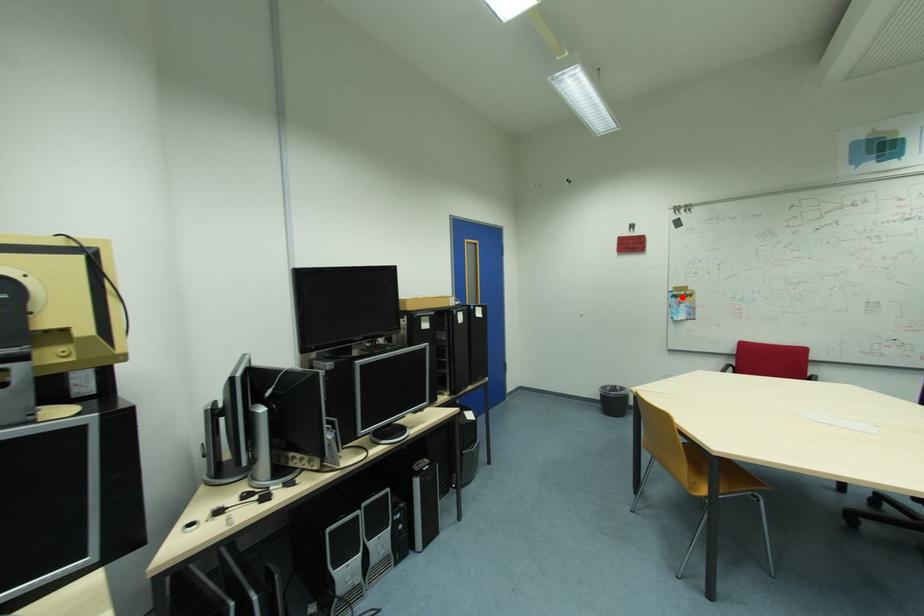
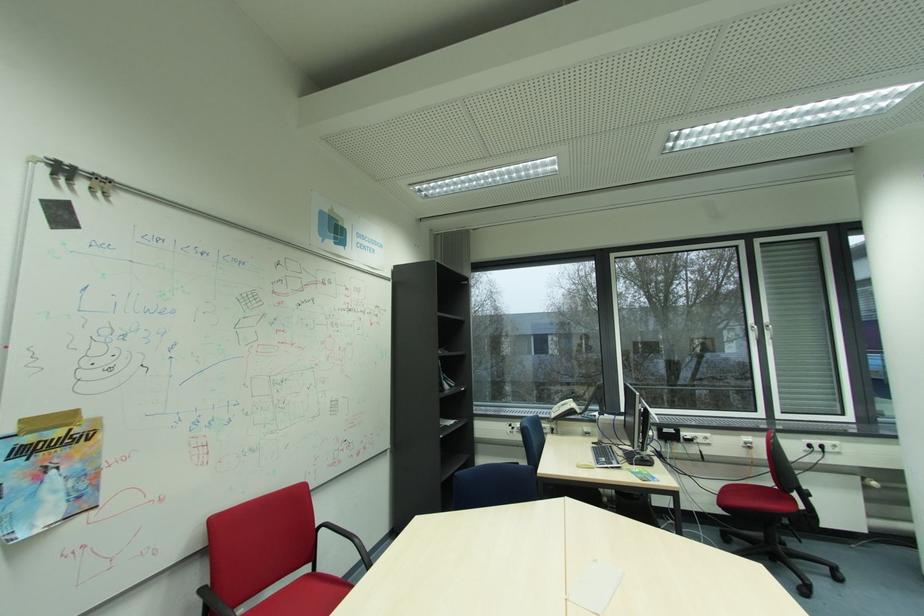
Find the pixel in the second image that matches the highlighted location in the first image.

(31, 452)